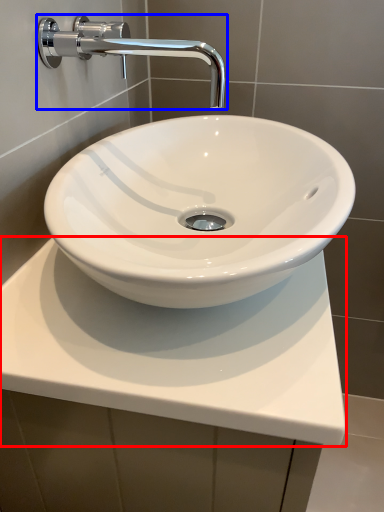
Question: Which object appears farthest to the camera in this image, counter top (highlighted by a red box) or tap (highlighted by a blue box)?

Choices:
 (A) counter top
 (B) tap

Answer: (B)